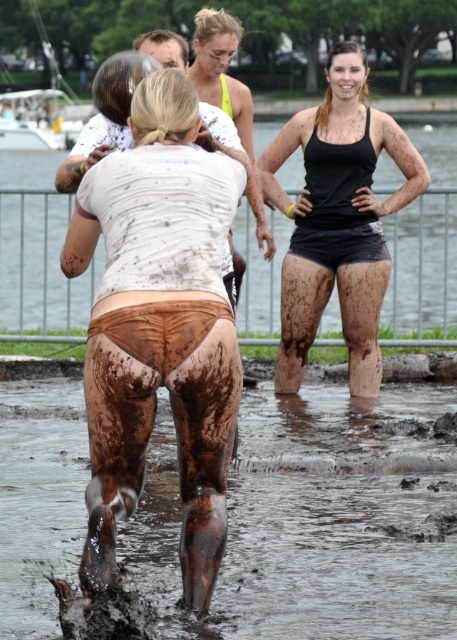
Question: Where is muddy water at lower center located in relation to muddy skin at lower center in the image?

Choices:
 (A) right
 (B) left

Answer: (A)

Question: Is muddy fabric shorts at center positioned before matte black tank top at center?

Choices:
 (A) no
 (B) yes

Answer: (B)

Question: Which point is closer to the camera taking this photo?

Choices:
 (A) (302, 397)
 (B) (41, 164)
 (C) (217, 438)
 (D) (377, 282)

Answer: (C)

Question: Which point is closer to the camera?

Choices:
 (A) matte black tank top at center
 (B) muddy water at lower center

Answer: (B)

Question: Which point is farther to the camera?

Choices:
 (A) (54, 324)
 (B) (186, 432)

Answer: (A)

Question: Does muddy fabric shorts at center have a lesser width compared to matte black tank top at center?

Choices:
 (A) no
 (B) yes

Answer: (B)